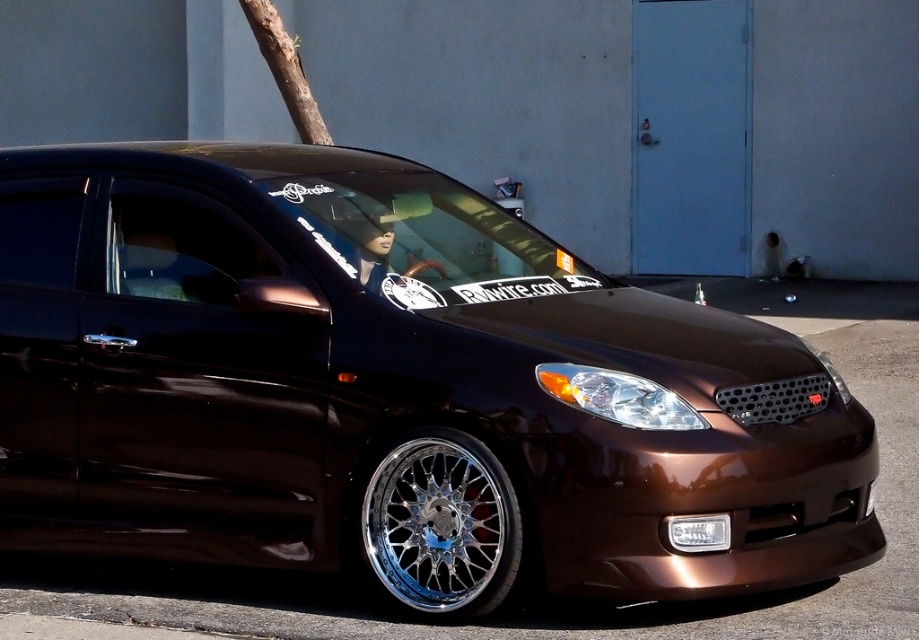
In the scene shown: Is shiny brown car at center bigger than white plastic license plate at center?

Correct, shiny brown car at center is larger in size than white plastic license plate at center.

Is shiny brown car at center smaller than white plastic license plate at center?

Incorrect, shiny brown car at center is not smaller in size than white plastic license plate at center.

The image size is (919, 640). I want to click on shiny brown car at center, so click(391, 388).

Which is in front, point (464, 340) or point (434, 509)?

Point (464, 340)

Which is below, shiny brown car at center or chrome/metallic wheel at lower center?

chrome/metallic wheel at lower center is lower down.

The image size is (919, 640). I want to click on shiny brown car at center, so click(391, 388).

Where is `shiny brown car at center`? This screenshot has width=919, height=640. shiny brown car at center is located at coordinates (391, 388).

Can you confirm if chrome/metallic wheel at lower center is shorter than white plastic license plate at center?

No, chrome/metallic wheel at lower center is not shorter than white plastic license plate at center.

How much distance is there between chrome/metallic wheel at lower center and white plastic license plate at center?

chrome/metallic wheel at lower center is 37.43 inches away from white plastic license plate at center.

What are the coordinates of `chrome/metallic wheel at lower center` in the screenshot? It's located at (437, 525).

This screenshot has width=919, height=640. What are the coordinates of `chrome/metallic wheel at lower center` in the screenshot? It's located at (437, 525).